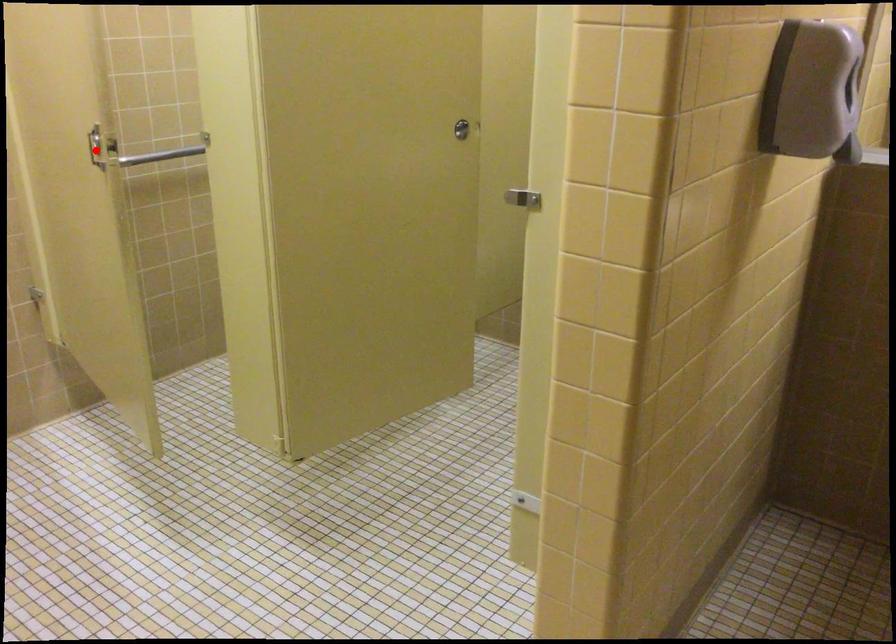
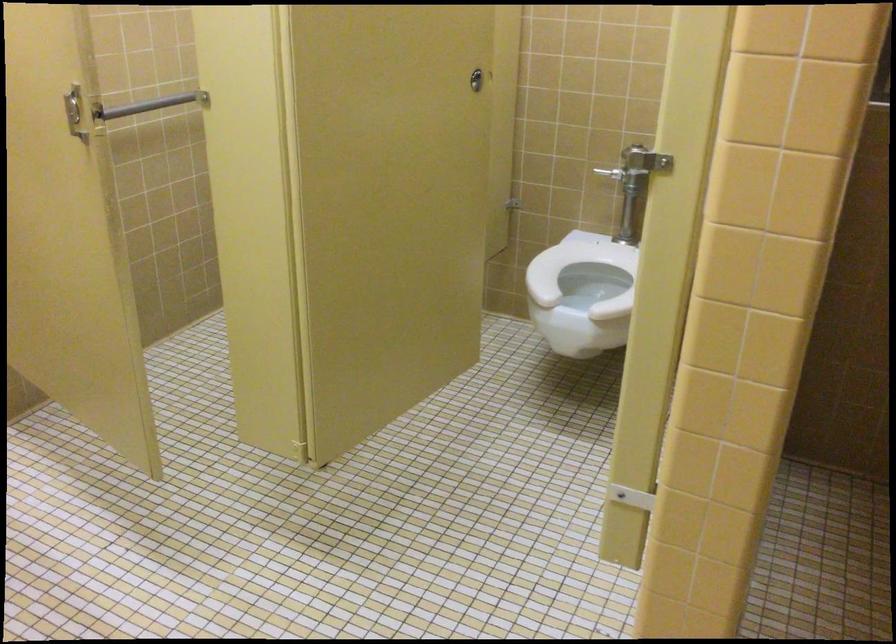
Find the pixel in the second image that matches the highlighted location in the first image.

(74, 111)